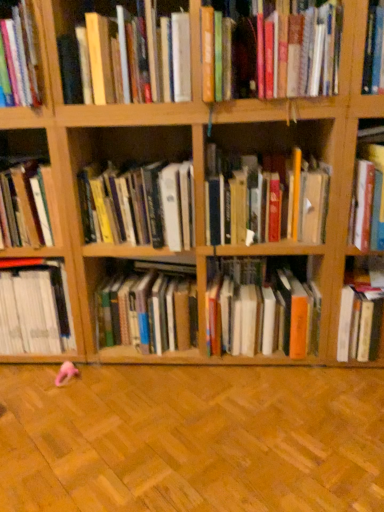
Question: Is hardcover book at upper right, which is counted as the 2th book, starting from the right, at the right side of orange matte book at center, arranged as the third book when viewed from the right?

Choices:
 (A) no
 (B) yes

Answer: (B)

Question: Could you tell me if hardcover book at upper right, the tenth book when ordered from left to right, is facing orange matte book at center, arranged as the 9th book when viewed from the left?

Choices:
 (A) yes
 (B) no

Answer: (B)

Question: From the image's perspective, is hardcover book at upper right, which is counted as the 2th book, starting from the right, on top of orange matte book at center, arranged as the 9th book when viewed from the left?

Choices:
 (A) no
 (B) yes

Answer: (B)

Question: From the image's perspective, is hardcover book at upper right, which is counted as the 2th book, starting from the right, beneath orange matte book at center, arranged as the third book when viewed from the right?

Choices:
 (A) yes
 (B) no

Answer: (B)

Question: From a real-world perspective, is hardcover book at upper right, which is counted as the 2th book, starting from the right, on orange matte book at center, arranged as the third book when viewed from the right?

Choices:
 (A) yes
 (B) no

Answer: (A)

Question: In the image, is hardcover book at center, the 6th book positioned from the left, on the left side or the right side of hardcover book at center, which appears as the 4th book when viewed from the right?

Choices:
 (A) right
 (B) left

Answer: (B)

Question: Looking at the image, does hardcover book at center, the 6th book positioned from the left, seem bigger or smaller compared to hardcover book at center, which appears as the 4th book when viewed from the right?

Choices:
 (A) small
 (B) big

Answer: (B)

Question: Considering their positions, is hardcover book at center, the 6th book positioned from the left, located in front of or behind hardcover book at center, which appears as the 4th book when viewed from the right?

Choices:
 (A) behind
 (B) front

Answer: (A)

Question: Would you say hardcover book at center, placed as the sixth book when sorted from right to left, is inside or outside hardcover book at center, which appears as the 4th book when viewed from the right?

Choices:
 (A) outside
 (B) inside

Answer: (A)

Question: In terms of height, does orange matte book at center, arranged as the third book when viewed from the right, look taller or shorter compared to hardcover book at right, placed as the 1th book when sorted from right to left?

Choices:
 (A) short
 (B) tall

Answer: (B)

Question: Considering their positions, is orange matte book at center, arranged as the third book when viewed from the right, located in front of or behind hardcover book at right, placed as the 1th book when sorted from right to left?

Choices:
 (A) front
 (B) behind

Answer: (A)

Question: From a real-world perspective, is orange matte book at center, arranged as the 9th book when viewed from the left, physically located above or below hardcover book at right, which is the eleventh book from left to right?

Choices:
 (A) above
 (B) below

Answer: (A)

Question: Looking at the image, does orange matte book at center, arranged as the third book when viewed from the right, seem bigger or smaller compared to hardcover book at right, which is the eleventh book from left to right?

Choices:
 (A) big
 (B) small

Answer: (A)

Question: Do you think hardcover book at center, the eighth book viewed from the right, is within orange matte book at center, arranged as the 9th book when viewed from the left, or outside of it?

Choices:
 (A) outside
 (B) inside

Answer: (A)

Question: Is hardcover book at center, the eighth book viewed from the right, in front of or behind orange matte book at center, arranged as the third book when viewed from the right, in the image?

Choices:
 (A) behind
 (B) front

Answer: (B)